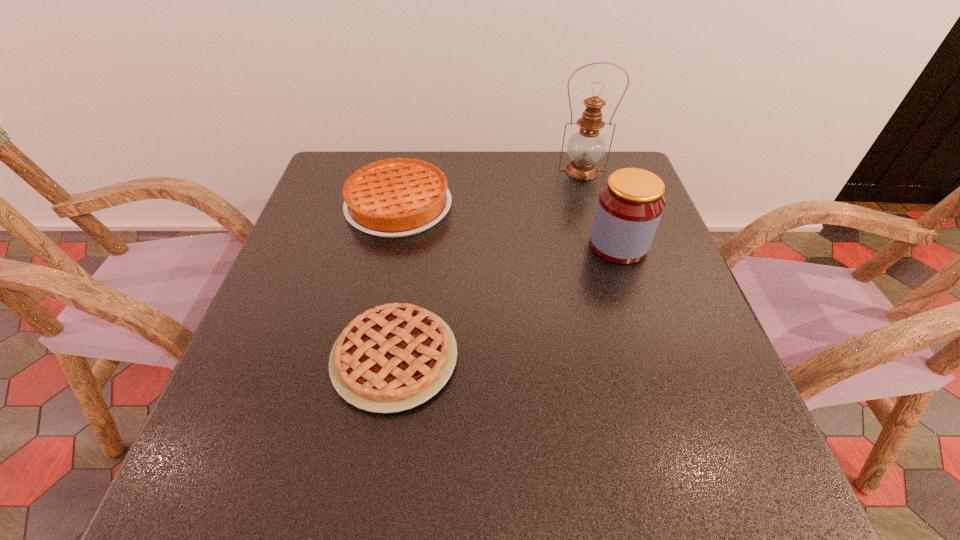
At what (x,y) coordinates should I click in order to perform the action: click on free point at the far left corner. Please return your answer as a coordinate pair (x, y). The height and width of the screenshot is (540, 960). Looking at the image, I should click on (327, 164).

Locate an element on the screen. The width and height of the screenshot is (960, 540). vacant space at the far right corner of the desktop is located at coordinates (606, 153).

In the image, there is a desktop. At what (x,y) coordinates should I click in order to perform the action: click on vacant space at the near right corner. Please return your answer as a coordinate pair (x, y). This screenshot has height=540, width=960. Looking at the image, I should click on (674, 458).

This screenshot has width=960, height=540. I want to click on free point between the shorter pie and the oil lamp, so click(489, 264).

The width and height of the screenshot is (960, 540). Find the location of `free area in between the nearest object and the third shortest object`. free area in between the nearest object and the third shortest object is located at coordinates (507, 301).

Identify the location of vacant point located between the nearer pie and the farther pie. This screenshot has width=960, height=540. (396, 282).

Where is `free space between the jar and the farther pie`? This screenshot has width=960, height=540. free space between the jar and the farther pie is located at coordinates (509, 225).

The image size is (960, 540). I want to click on vacant area that lies between the farther pie and the tallest object, so click(491, 188).

You are a GUI agent. You are given a task and a screenshot of the screen. Output one action in this format:
    pyautogui.click(x=<x>, y=<y>)
    Task: Click on the free space between the jar and the nearest object
    The width and height of the screenshot is (960, 540).
    Given the screenshot: What is the action you would take?
    pyautogui.click(x=507, y=301)

Identify the location of free space between the taller pie and the oil lamp. The width and height of the screenshot is (960, 540). [491, 188].